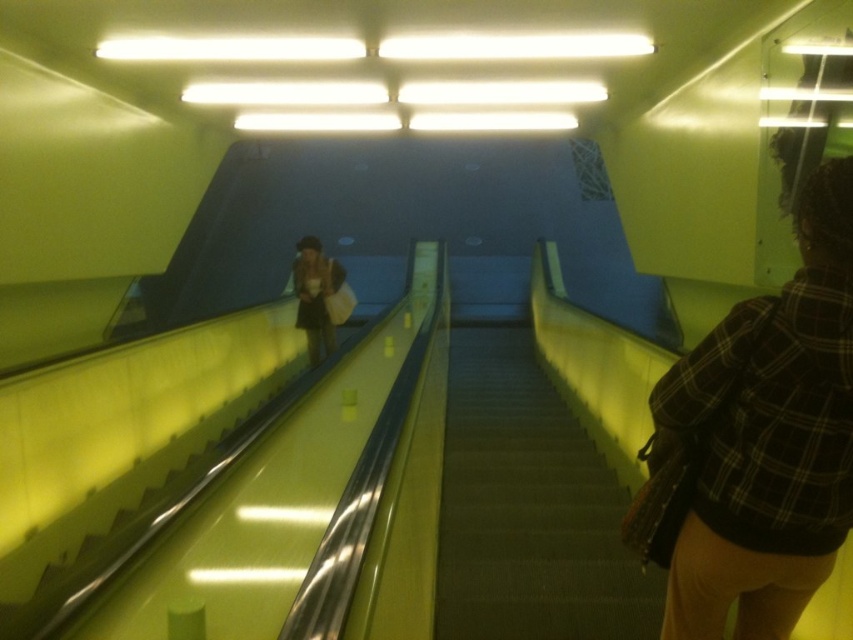
You are standing at the bottom of the escalator and want to place your matte beige bag at center on the dark gray carpeted stairs at center. Can you reach the stairs from where you are standing?

The dark gray carpeted stairs at center is closer to the viewer than the matte beige bag at center. Since you are standing at the bottom of the escalator, you can reach the stairs to place your bag.

You are standing at the bottom of the escalator in the yellow walls area. You see a plaid fabric shirt at right. Where exactly is the plaid fabric shirt located relative to the escalator steps?

The plaid fabric shirt at right is located at point 0.684 on the x axis and 0.900 on the y axis relative to the escalator steps.